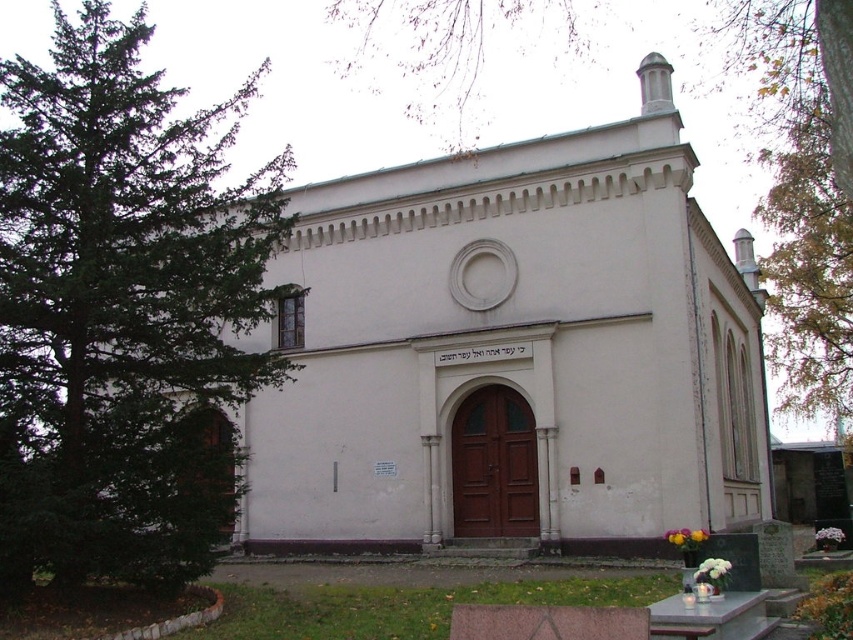
Is white smooth church at center positioned behind green evergreen tree at left?

Yes, white smooth church at center is behind green evergreen tree at left.

Does white smooth church at center appear under green evergreen tree at left?

Yes.

Who is more distant from viewer, (x=367, y=196) or (x=161, y=456)?

Point (x=367, y=196)

The height and width of the screenshot is (640, 853). I want to click on white smooth church at center, so click(x=512, y=353).

Is green evergreen tree at left smaller than green leafy tree at upper left?

Correct, green evergreen tree at left occupies less space than green leafy tree at upper left.

Between green evergreen tree at left and green leafy tree at upper left, which one has less height?

green leafy tree at upper left

Measure the distance between green evergreen tree at left and camera.

green evergreen tree at left and camera are 98.35 feet apart.

You are a GUI agent. You are given a task and a screenshot of the screen. Output one action in this format:
    pyautogui.click(x=<x>, y=<y>)
    Task: Click on the green evergreen tree at left
    Image resolution: width=853 pixels, height=640 pixels.
    Given the screenshot: What is the action you would take?
    pyautogui.click(x=123, y=310)

Which is below, white smooth church at center or green leafy tree at upper left?

white smooth church at center is lower down.

Is white smooth church at center closer to the viewer compared to green leafy tree at upper left?

No.

Who is more forward, (408, 205) or (846, 44)?

Positioned in front is point (846, 44).

At what (x,y) coordinates should I click in order to perform the action: click on white smooth church at center. Please return your answer as a coordinate pair (x, y). Looking at the image, I should click on (512, 353).